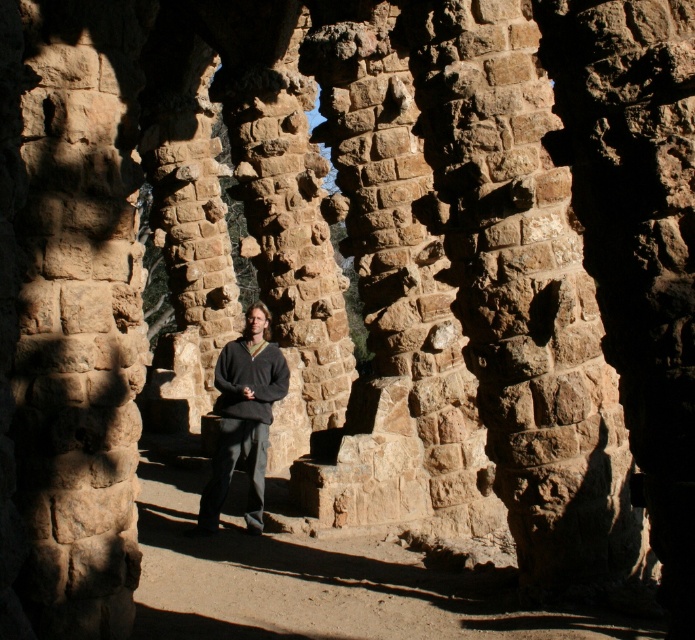
Question: Does dark gray sweater at center appear under dark gray wool sweater at center?

Choices:
 (A) no
 (B) yes

Answer: (B)

Question: Does dark gray sweater at center appear on the left side of dark gray wool sweater at center?

Choices:
 (A) no
 (B) yes

Answer: (B)

Question: Among these points, which one is nearest to the camera?

Choices:
 (A) (212, 486)
 (B) (234, 372)

Answer: (A)

Question: Which point appears closest to the camera in this image?

Choices:
 (A) (220, 365)
 (B) (272, 362)

Answer: (A)

Question: Which point is farther from the camera taking this photo?

Choices:
 (A) click(x=277, y=390)
 (B) click(x=212, y=454)

Answer: (B)

Question: Can you confirm if dark gray sweater at center is thinner than dark gray wool sweater at center?

Choices:
 (A) no
 (B) yes

Answer: (A)